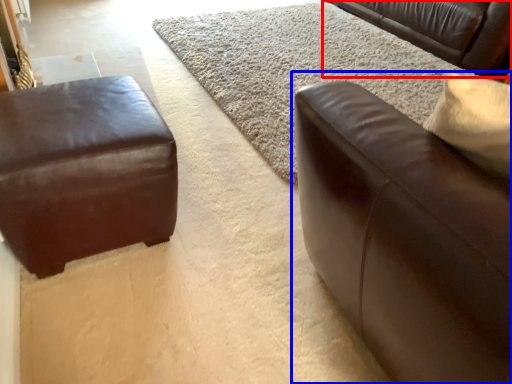
Question: Which point is further to the camera, studio couch (highlighted by a red box) or studio couch (highlighted by a blue box)?

Choices:
 (A) studio couch
 (B) studio couch

Answer: (A)